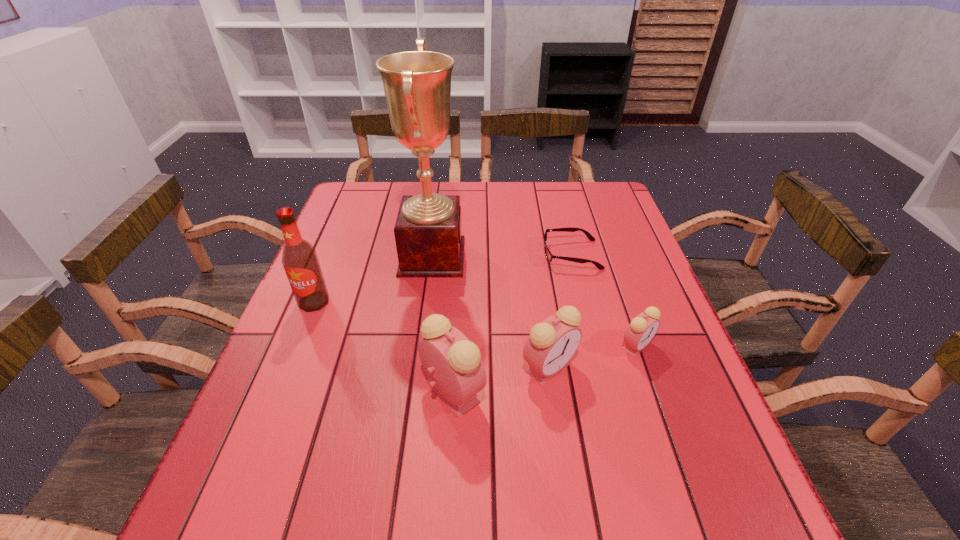
Where is `the leftmost alarm clock`? the leftmost alarm clock is located at coordinates (456, 373).

Image resolution: width=960 pixels, height=540 pixels. I want to click on the second tallest alarm clock, so click(552, 343).

The width and height of the screenshot is (960, 540). Identify the location of the fourth tallest object. (552, 343).

Where is `the rightmost alarm clock`? the rightmost alarm clock is located at coordinates (643, 327).

Identify the location of the shortest alarm clock. (643, 327).

The height and width of the screenshot is (540, 960). I want to click on the leftmost object, so click(x=299, y=258).

The width and height of the screenshot is (960, 540). I want to click on the second tallest object, so click(299, 258).

Locate an element on the screen. The height and width of the screenshot is (540, 960). the tallest object is located at coordinates (417, 84).

Identify the location of the shortest object. The width and height of the screenshot is (960, 540). (549, 256).

Image resolution: width=960 pixels, height=540 pixels. In order to click on free space located on the face of the leftmost alarm clock in this screenshot , I will do `click(546, 392)`.